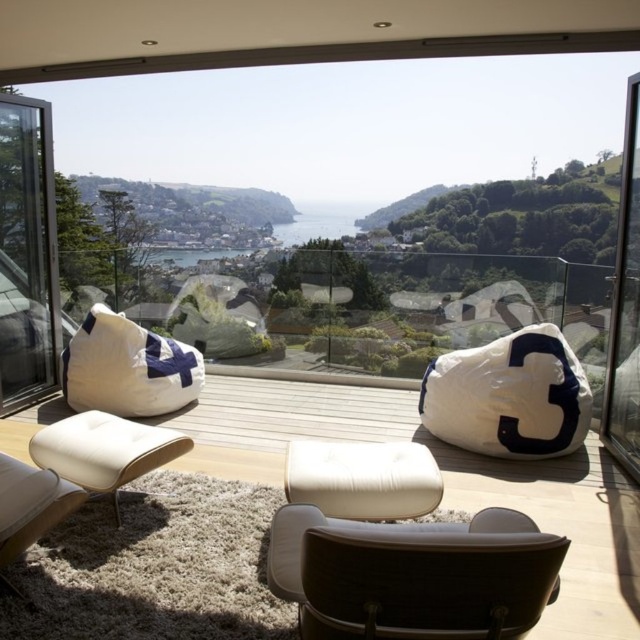
Question: Is leather chair at center closer to the viewer compared to white leather chair at lower left?

Choices:
 (A) yes
 (B) no

Answer: (A)

Question: Which point is closer to the camera taking this photo?

Choices:
 (A) (417, 602)
 (B) (516, 332)
 (C) (476, 188)

Answer: (A)

Question: Which point is farther to the camera?

Choices:
 (A) transparent glass door at right
 (B) white leather chair at lower left
 (C) white fabric bean bag at left

Answer: (C)

Question: In this image, where is transparent glass window at center located relative to leather chair at center?

Choices:
 (A) left
 (B) right

Answer: (A)

Question: Based on their relative distances, which object is farther from the leather chair at center?

Choices:
 (A) white fabric bean bag at center
 (B) white fabric bean bag at left

Answer: (B)

Question: Can you confirm if white fabric bean bag at center is wider than white fabric bean bag at left?

Choices:
 (A) no
 (B) yes

Answer: (B)